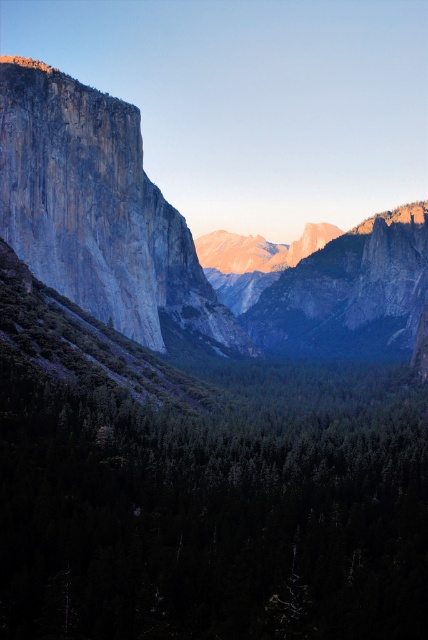
You are standing at the edge of the cliff on the left side of the mountain view. You want to reach the green matte forest at center. Which direction should you head towards?

You should head towards the center of the image to reach the green matte forest at center, as it is located at point coordinates [216,509].

You are standing on the cliff edge on the left side of the image. You see a point marked at coordinates [216,509]. According to the image, what is the location of this point relative to the green matte forest at center?

The point [216,509] is located on the green matte forest at center.

You are a hiker planning to traverse from the valley to the mountain peak. You see the green matte forest at center and the granite cliff face at left. Which path would require ascending a steeper incline?

The path to the granite cliff face at left requires ascending a steeper incline because the green matte forest at center is positioned under it, indicating the cliff is higher.